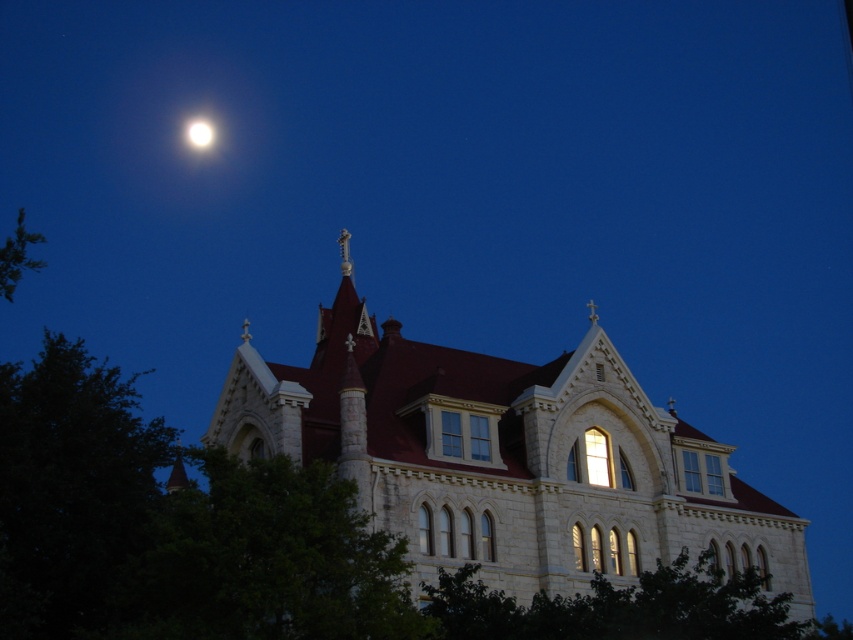
Which is below, bright white orb at upper center or bright white orb at upper left?

bright white orb at upper center

Who is more distant from viewer, (202, 147) or (206, 147)?

The point (206, 147) is more distant.

Which is in front, point (206, 124) or point (190, 122)?

Point (190, 122) is in front.

The width and height of the screenshot is (853, 640). I want to click on bright white orb at upper center, so click(x=200, y=132).

Measure the distance between point (612, 432) and camera.

They are 222.56 feet apart.

Is point (738, 554) behind point (204, 145)?

No, it is in front of (204, 145).

Describe the element at coordinates (506, 456) in the screenshot. I see `white stone church at center` at that location.

I want to click on white stone church at center, so click(x=506, y=456).

Is white stone church at center closer to camera compared to bright white orb at upper center?

Yes, white stone church at center is closer to the viewer.

Which is below, white stone church at center or bright white orb at upper center?

white stone church at center is below.

Image resolution: width=853 pixels, height=640 pixels. In order to click on white stone church at center in this screenshot , I will do `click(506, 456)`.